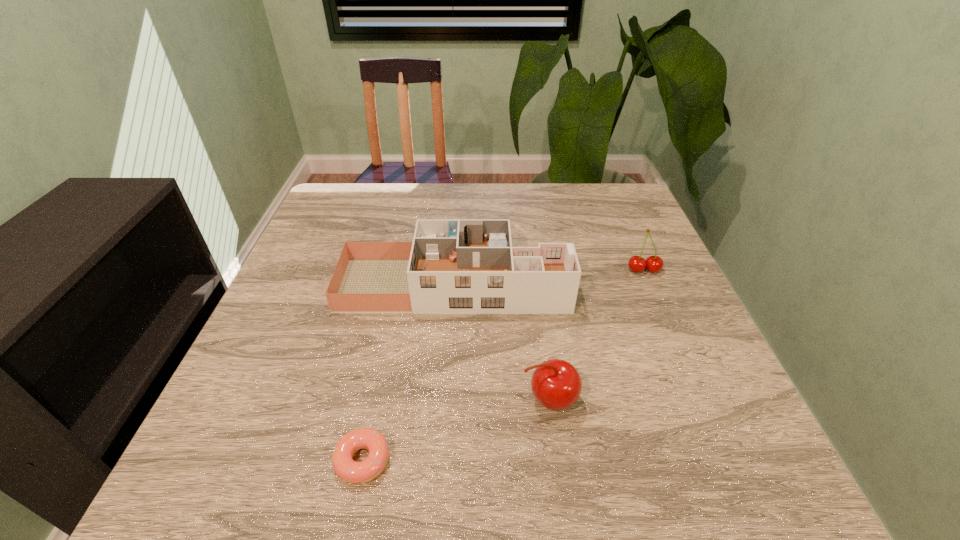
What are the coordinates of `unoccupied area between the left cherry and the doughnut` in the screenshot? It's located at (456, 430).

At what (x,y) coordinates should I click in order to perform the action: click on free space between the doughnut and the dollhouse. Please return your answer as a coordinate pair (x, y). The width and height of the screenshot is (960, 540). Looking at the image, I should click on tap(408, 373).

At what (x,y) coordinates should I click in order to perform the action: click on free spot between the nearest object and the rightmost object. Please return your answer as a coordinate pair (x, y). This screenshot has height=540, width=960. Looking at the image, I should click on (503, 365).

Image resolution: width=960 pixels, height=540 pixels. I want to click on unoccupied area between the rightmost object and the nearer cherry, so click(596, 335).

This screenshot has width=960, height=540. I want to click on free point between the doughnut and the dollhouse, so click(408, 373).

Image resolution: width=960 pixels, height=540 pixels. What are the coordinates of `vacant area that lies between the doughnut and the nearer cherry` in the screenshot? It's located at (456, 430).

I want to click on empty space that is in between the shortest object and the left cherry, so click(x=456, y=430).

Identify the location of free point between the doughnut and the dollhouse. (408, 373).

Identify which object is the second closest to the dollhouse. Please provide its 2D coordinates. Your answer should be formatted as a tuple, i.e. [(x, y)], where the tuple contains the x and y coordinates of a point satisfying the conditions above.

[(556, 384)]

Where is `object that stands as the second closest to the second nearest object`? This screenshot has height=540, width=960. object that stands as the second closest to the second nearest object is located at coordinates (351, 471).